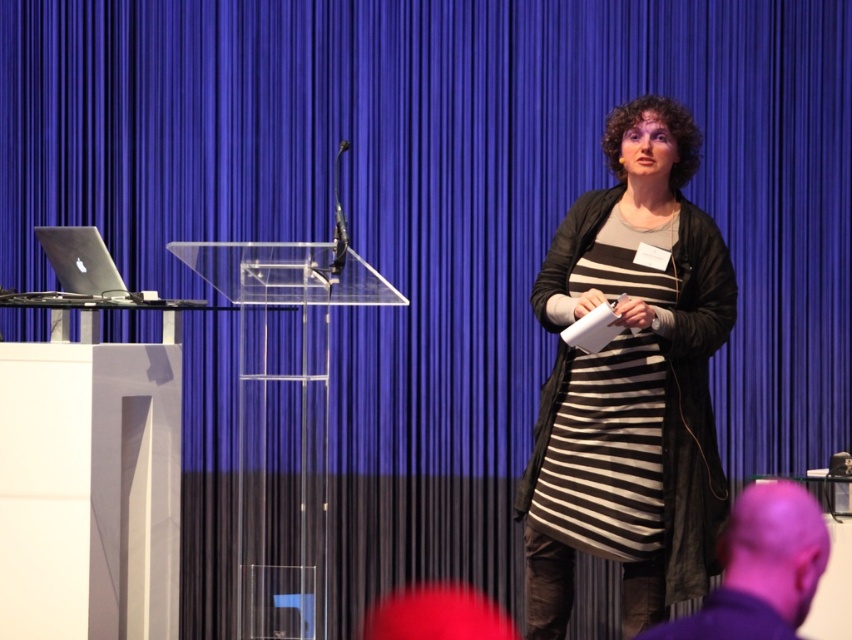
You are standing in the presentation room and see two points marked in the image. Which point is closer to you, point (x=636, y=132) or point (x=62, y=253)?

Point (x=636, y=132) is in front of point (x=62, y=253), so it is closer to you.

In the presentation scene, there is a purple hair at lower right. What are its exact coordinates?

The purple hair at lower right is located at coordinates (760, 568).